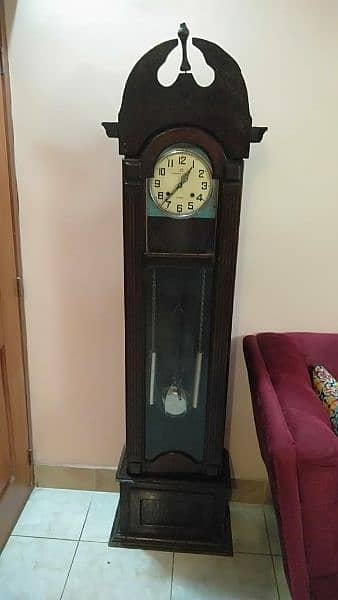
Where is `wall`? wall is located at coordinates (100, 372).